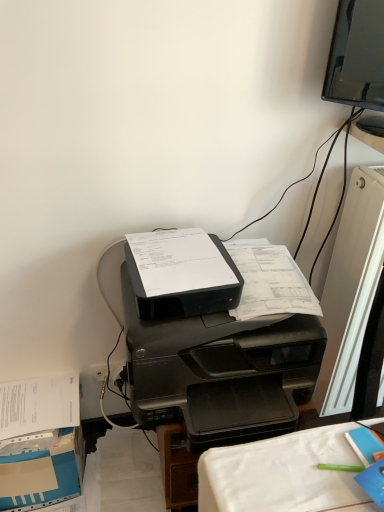
Question: Could you tell me if black plastic printer at center is facing white plastic radiator at right?

Choices:
 (A) no
 (B) yes

Answer: (A)

Question: Is black plastic printer at center not inside white plastic radiator at right?

Choices:
 (A) yes
 (B) no

Answer: (A)

Question: Does black plastic printer at center have a larger size compared to white plastic radiator at right?

Choices:
 (A) no
 (B) yes

Answer: (B)

Question: Is black plastic printer at center smaller than white plastic radiator at right?

Choices:
 (A) yes
 (B) no

Answer: (B)

Question: Is black plastic printer at center surrounding white plastic radiator at right?

Choices:
 (A) no
 (B) yes

Answer: (A)

Question: Can you confirm if black plastic printer at center is taller than white plastic radiator at right?

Choices:
 (A) yes
 (B) no

Answer: (B)

Question: Considering the relative sizes of black plastic printer at center and blue cardboard box at lower left in the image provided, is black plastic printer at center smaller than blue cardboard box at lower left?

Choices:
 (A) yes
 (B) no

Answer: (B)

Question: Can you confirm if black plastic printer at center is taller than blue cardboard box at lower left?

Choices:
 (A) yes
 (B) no

Answer: (A)

Question: Is black plastic printer at center not within blue cardboard box at lower left?

Choices:
 (A) yes
 (B) no

Answer: (A)

Question: Considering the relative positions of black plastic printer at center and blue cardboard box at lower left in the image provided, is black plastic printer at center to the right of blue cardboard box at lower left from the viewer's perspective?

Choices:
 (A) yes
 (B) no

Answer: (A)

Question: Does black plastic printer at center have a lesser height compared to blue cardboard box at lower left?

Choices:
 (A) no
 (B) yes

Answer: (A)

Question: From the image's perspective, would you say black plastic printer at center is shown under blue cardboard box at lower left?

Choices:
 (A) yes
 (B) no

Answer: (B)

Question: Can you confirm if blue cardboard box at lower left is smaller than black plastic printer at center?

Choices:
 (A) yes
 (B) no

Answer: (A)